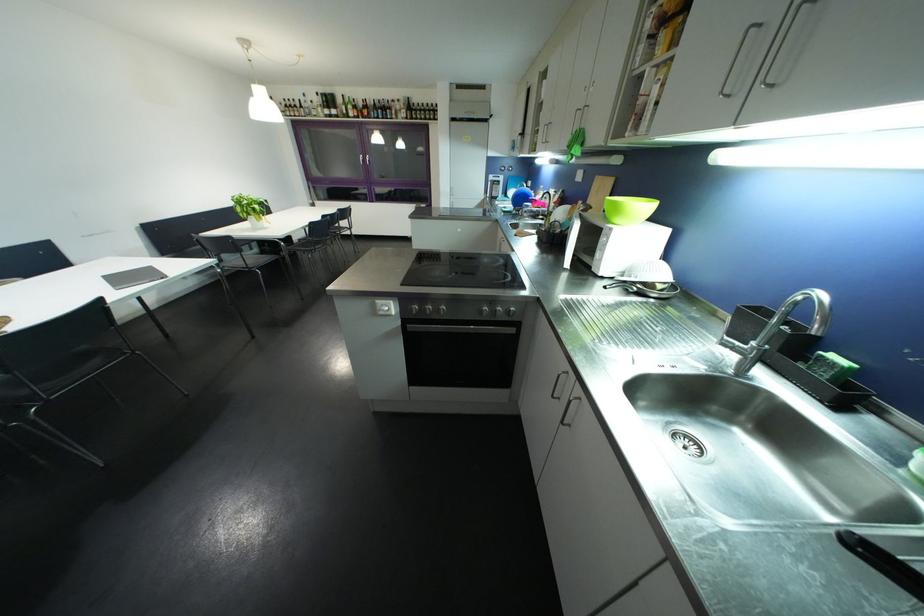
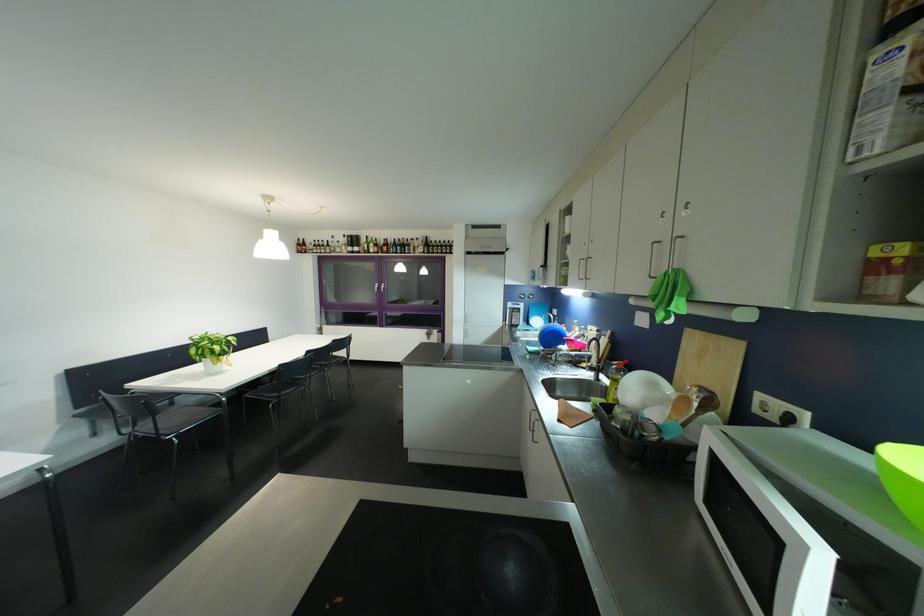
Question: Which direction would the cameraman need to move to produce the second image? Reply with the corresponding letter.

Choices:
 (A) Left
 (B) Right
 (C) Forward
 (D) Backward

Answer: (C)